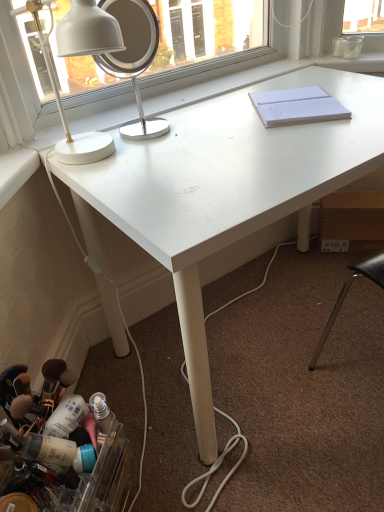
Question: Is white glossy desk lamp at upper left in front of or behind white matte desk at center in the image?

Choices:
 (A) behind
 (B) front

Answer: (A)

Question: From the image's perspective, relative to white matte desk at center, is white glossy desk lamp at upper left above or below?

Choices:
 (A) below
 (B) above

Answer: (B)

Question: Which is farther from the translucent plastic container at lower left?

Choices:
 (A) white smooth window sill at upper right
 (B) white paper notebook at upper right
 (C) white matte desk at center
 (D) white glossy desk lamp at upper left
 (E) white metallic mirror at upper left

Answer: (E)

Question: Estimate the real-world distances between objects in this image. Which object is closer to the white smooth window sill at upper right?

Choices:
 (A) white matte desk at center
 (B) white metallic mirror at upper left
 (C) white paper notebook at upper right
 (D) white glossy desk lamp at upper left
 (E) translucent plastic container at lower left

Answer: (C)